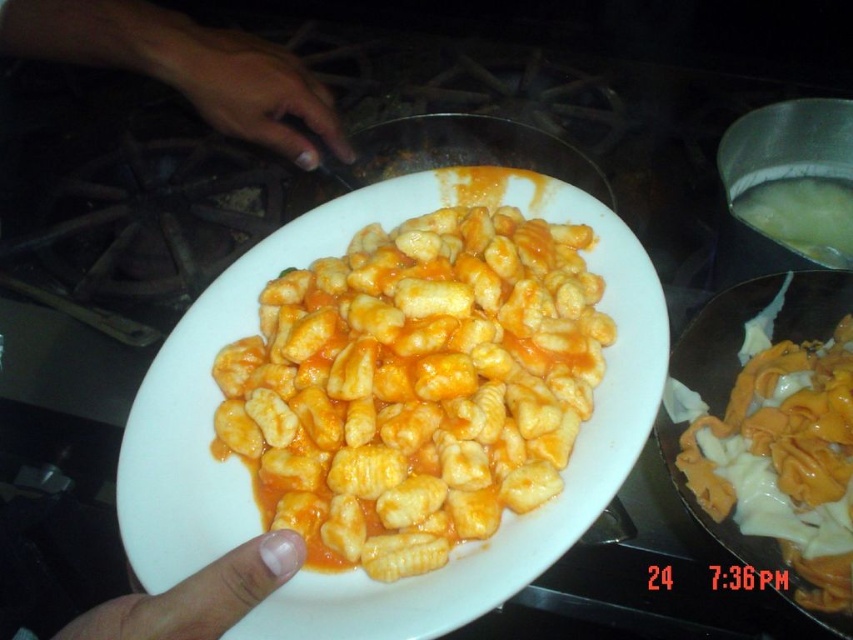
Does yellow matte gnocchi at center come behind smooth skin hand at upper center?

No.

Is yellow matte gnocchi at center smaller than smooth skin hand at upper center?

Actually, yellow matte gnocchi at center might be larger than smooth skin hand at upper center.

Who is more distant from viewer, (556,481) or (259,99)?

Point (259,99)

Find the location of a particular element. Image resolution: width=853 pixels, height=640 pixels. yellow matte gnocchi at center is located at coordinates (415, 387).

Image resolution: width=853 pixels, height=640 pixels. In order to click on yellow matte gnocchi at center in this screenshot , I will do `click(415, 387)`.

Does yellow matte gnocchi at center appear on the left side of nail polish on fingernail at lower center?

No, yellow matte gnocchi at center is not to the left of nail polish on fingernail at lower center.

The width and height of the screenshot is (853, 640). Describe the element at coordinates (415, 387) in the screenshot. I see `yellow matte gnocchi at center` at that location.

Locate an element on the screen. yellow matte gnocchi at center is located at coordinates (415, 387).

Does yellow matte gnocchi at center have a larger size compared to smooth skin hand at center?

Correct, yellow matte gnocchi at center is larger in size than smooth skin hand at center.

Who is more distant from viewer, (490, 262) or (253, 42)?

Positioned behind is point (253, 42).

Is point (498, 237) more distant than point (256, 104)?

No, (498, 237) is in front of (256, 104).

Find the location of a particular element. This screenshot has height=640, width=853. yellow matte gnocchi at center is located at coordinates (415, 387).